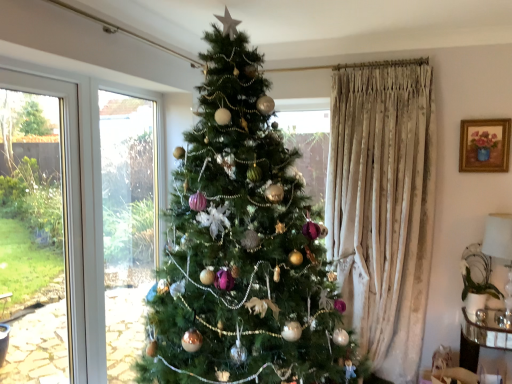
Question: Looking at their shapes, would you say green matte christmas tree at center is wider or thinner than gold-framed painting at upper right?

Choices:
 (A) wide
 (B) thin

Answer: (A)

Question: In terms of height, does green matte christmas tree at center look taller or shorter compared to gold-framed painting at upper right?

Choices:
 (A) tall
 (B) short

Answer: (A)

Question: Which is nearer to the clear glass side table at lower right?

Choices:
 (A) gold-framed painting at upper right
 (B) white glossy lampshade at right
 (C) green matte christmas tree at center

Answer: (B)

Question: Which object is the farthest from the clear glass side table at lower right?

Choices:
 (A) gold-framed painting at upper right
 (B) green matte christmas tree at center
 (C) white glossy lampshade at right

Answer: (B)